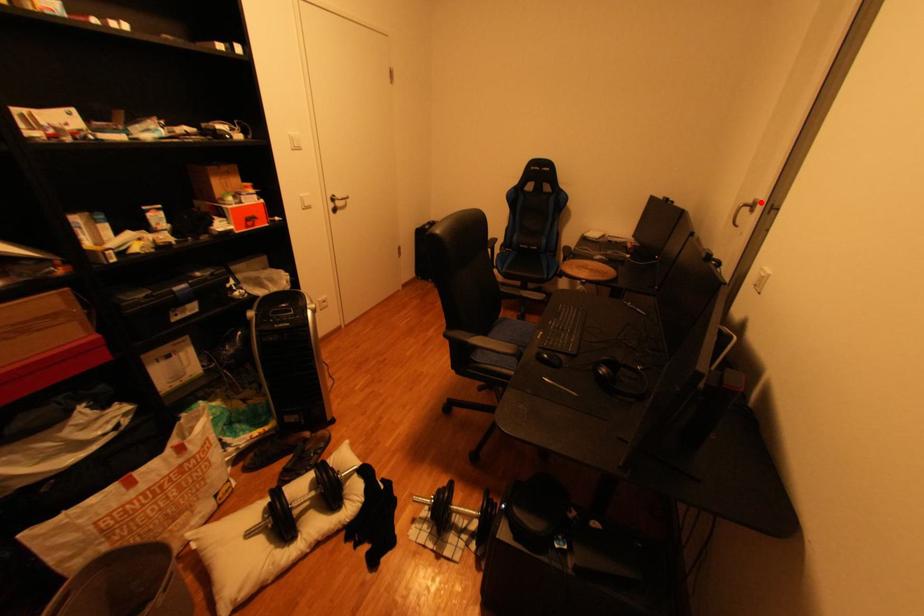
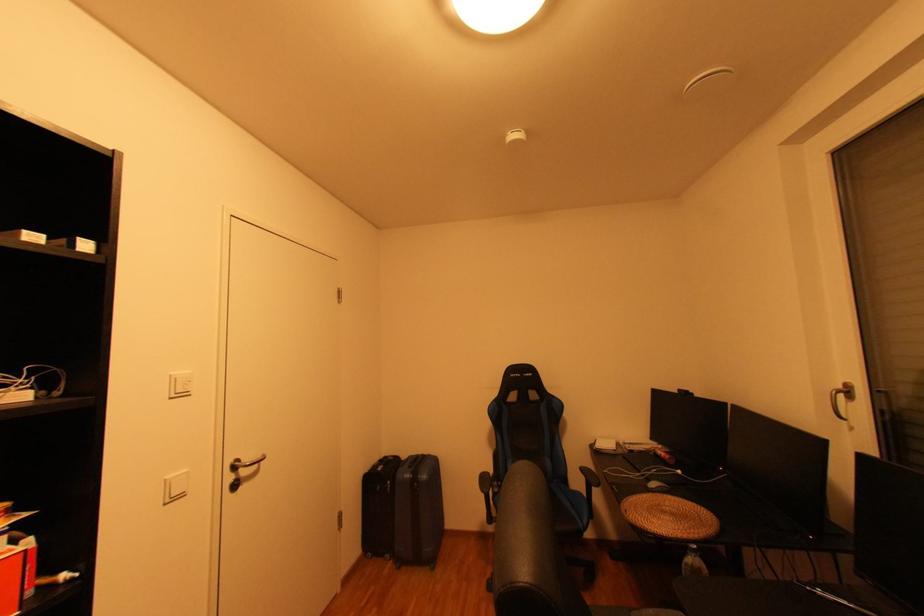
In the second image, find the point that corresponds to the highlighted location in the first image.

(849, 387)